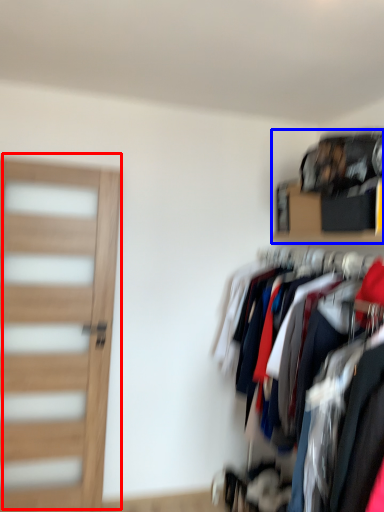
Question: Which object appears farthest to the camera in this image, door (highlighted by a red box) or shelf (highlighted by a blue box)?

Choices:
 (A) door
 (B) shelf

Answer: (A)